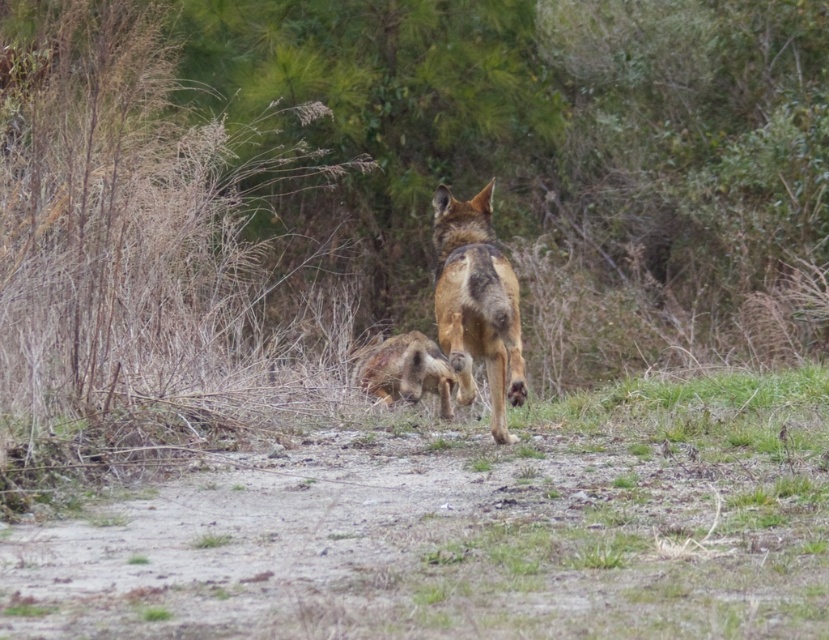
Which is more to the left, brown fur dog at center or furry brown animal at center?

furry brown animal at center is more to the left.

Is brown fur dog at center further to the viewer compared to furry brown animal at center?

No, brown fur dog at center is closer to the viewer.

Describe the element at coordinates (476, 304) in the screenshot. I see `brown fur dog at center` at that location.

The image size is (829, 640). I want to click on brown fur dog at center, so click(476, 304).

Can you confirm if brown dirt field at center is smaller than furry brown animal at center?

Correct, brown dirt field at center occupies less space than furry brown animal at center.

Where is `brown dirt field at center`? brown dirt field at center is located at coordinates (469, 529).

Can you confirm if brown dirt field at center is positioned to the left of brown fur dog at center?

Correct, you'll find brown dirt field at center to the left of brown fur dog at center.

How far apart are brown dirt field at center and brown fur dog at center?

The distance of brown dirt field at center from brown fur dog at center is 76.76 centimeters.

Who is more forward, (30, 563) or (451, 259)?

Point (30, 563)

Identify the location of brown dirt field at center. (469, 529).